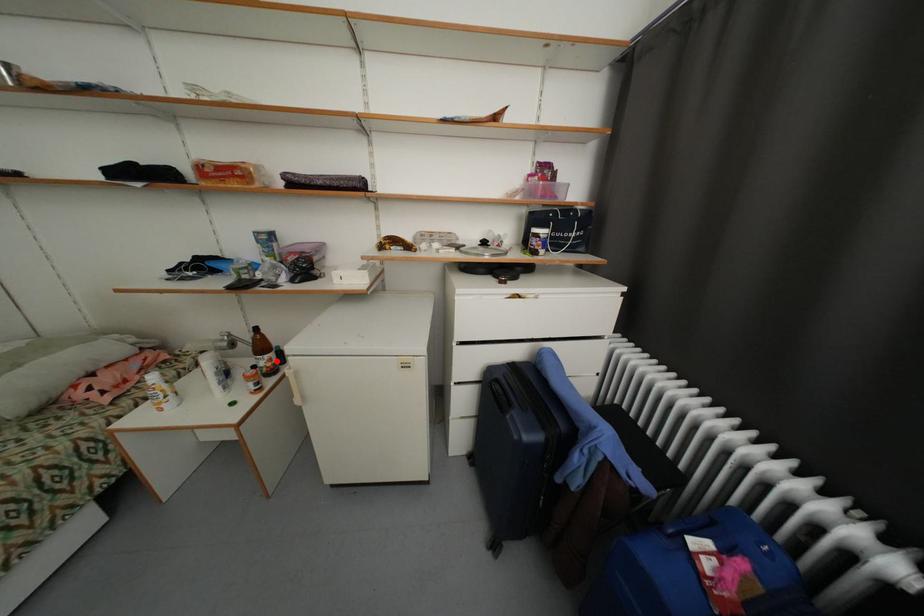
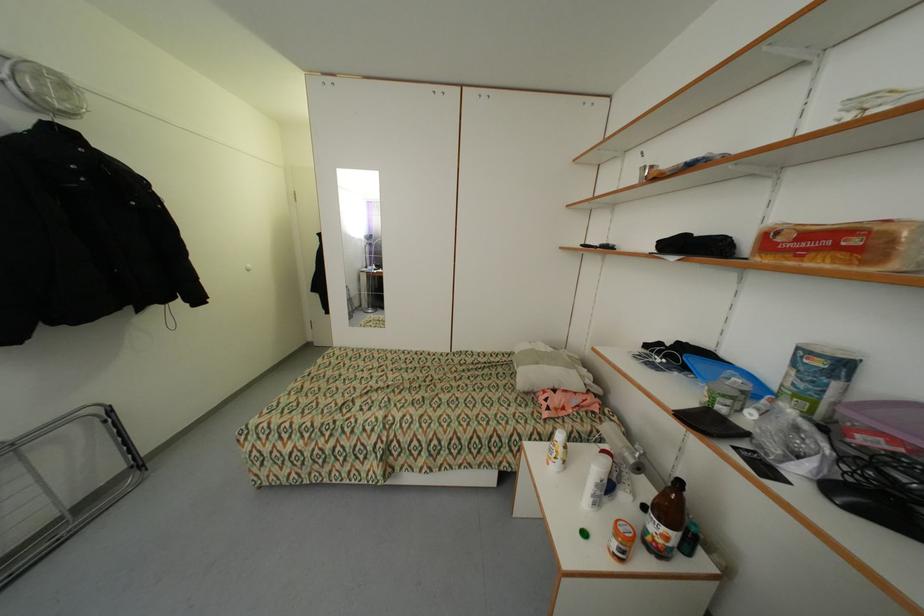
Question: I am providing you with two images of the same scene from different viewpoints. In image1, a red point is highlighted. Considering the same 3D point in image2, which of the following is correct?

Choices:
 (A) It is closer
 (B) It is farther

Answer: (A)